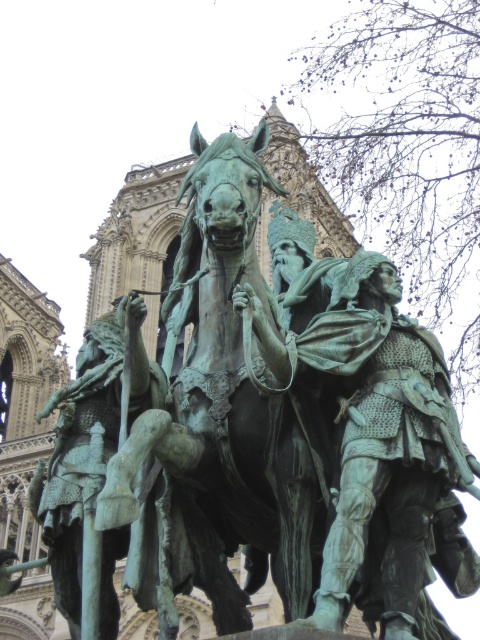
Who is positioned more to the right, green patinated bronze horse at center or green patina statue at center?

From the viewer's perspective, green patinated bronze horse at center appears more on the right side.

Between point (268, 353) and point (119, 435), which one is positioned behind?

Positioned behind is point (119, 435).

This screenshot has width=480, height=640. I want to click on green patinated bronze horse at center, so 228,385.

Locate an element on the screen. green patina armor at center is located at coordinates (372, 436).

Is green patina armor at center shorter than green patinated bronze horse at center?

Correct, green patina armor at center is not as tall as green patinated bronze horse at center.

Image resolution: width=480 pixels, height=640 pixels. In order to click on green patina armor at center in this screenshot , I will do `click(372, 436)`.

Who is higher up, green patina armor at center or green patina statue at center?

Positioned higher is green patina statue at center.

Where is `green patina armor at center`? This screenshot has width=480, height=640. green patina armor at center is located at coordinates (372, 436).

Who is more distant from viewer, (441, 621) or (152, 376)?

The point (152, 376) is more distant.

Identify the location of green patina armor at center. (372, 436).